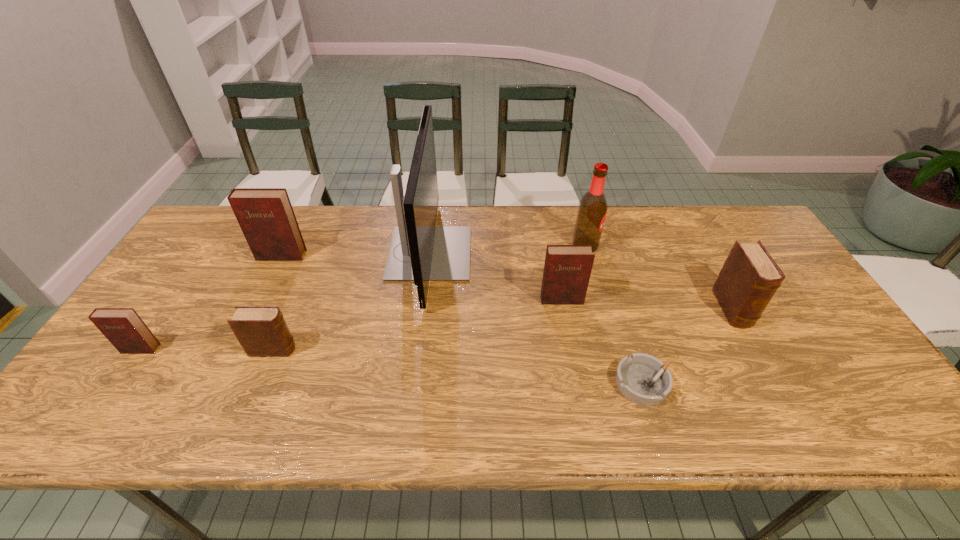
The height and width of the screenshot is (540, 960). Find the location of `the nearer brown diary`. the nearer brown diary is located at coordinates (262, 331).

What are the coordinates of `the smallest reddish-brown diary` in the screenshot? It's located at (123, 327).

The image size is (960, 540). What are the coordinates of `the nearest reddish-brown diary` in the screenshot? It's located at (123, 327).

You are a GUI agent. You are given a task and a screenshot of the screen. Output one action in this format:
    pyautogui.click(x=<x>, y=<y>)
    Task: Click on the nearest object
    The width and height of the screenshot is (960, 540).
    Given the screenshot: What is the action you would take?
    643,379

I want to click on the shortest object, so click(x=643, y=379).

Identify the location of free region located on the screen of the fourth object from left to right. The width and height of the screenshot is (960, 540). (594, 253).

The height and width of the screenshot is (540, 960). In order to click on vacant space located 0.150m on the left of the second tallest object in this screenshot , I will do `click(525, 246)`.

Find the location of a particular element. Image resolution: width=960 pixels, height=540 pixels. vacant space located on the front cover of the third tallest object is located at coordinates (272, 275).

You are a GUI agent. You are given a task and a screenshot of the screen. Output one action in this format:
    pyautogui.click(x=<x>, y=<y>)
    Task: Click on the vacant area situated 0.070m on the spine side of the bigger brown diary
    The image size is (960, 540).
    Given the screenshot: What is the action you would take?
    pyautogui.click(x=756, y=353)

You are a GUI agent. You are given a task and a screenshot of the screen. Output one action in this format:
    pyautogui.click(x=<x>, y=<y>)
    Task: Click on the free space located 0.260m on the front cover of the second biggest reddish-brown diary
    This screenshot has width=960, height=540.
    Given the screenshot: What is the action you would take?
    pyautogui.click(x=578, y=388)